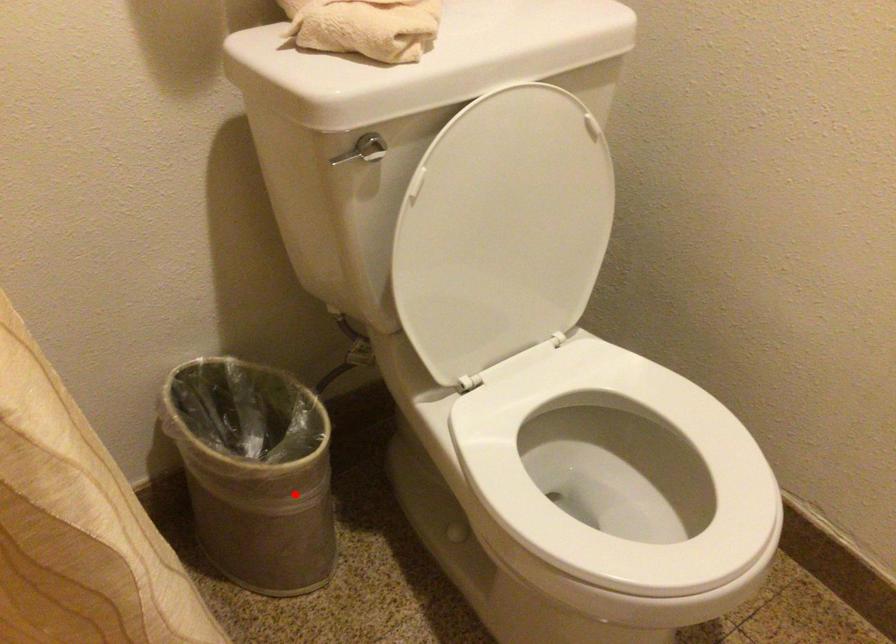
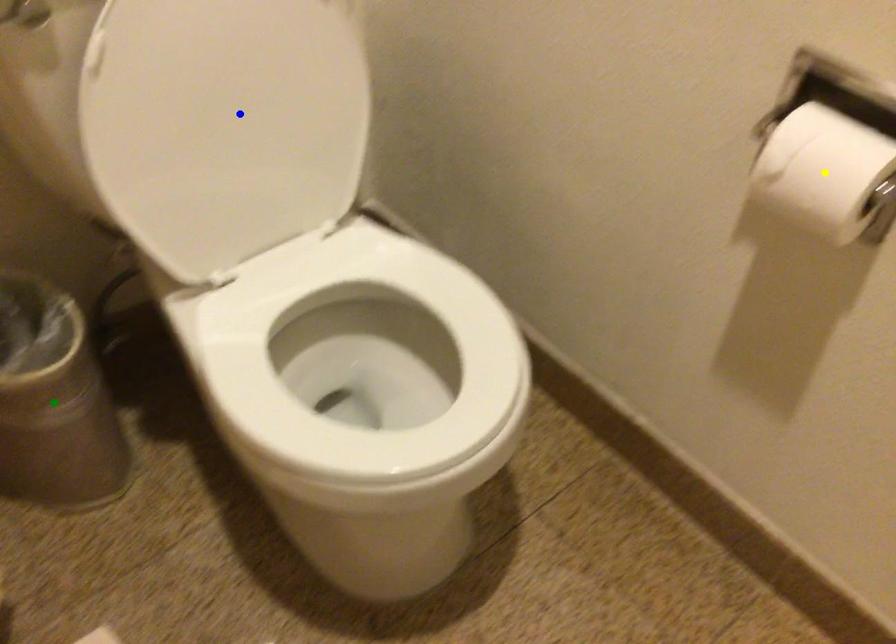
Question: I am providing you with two images of the same scene from different viewpoints. A red point is marked on the first image. You are given multiple points on the second image. Which point in image 2 represents the same 3d spot as the red point in image 1?

Choices:
 (A) green point
 (B) blue point
 (C) yellow point

Answer: (A)